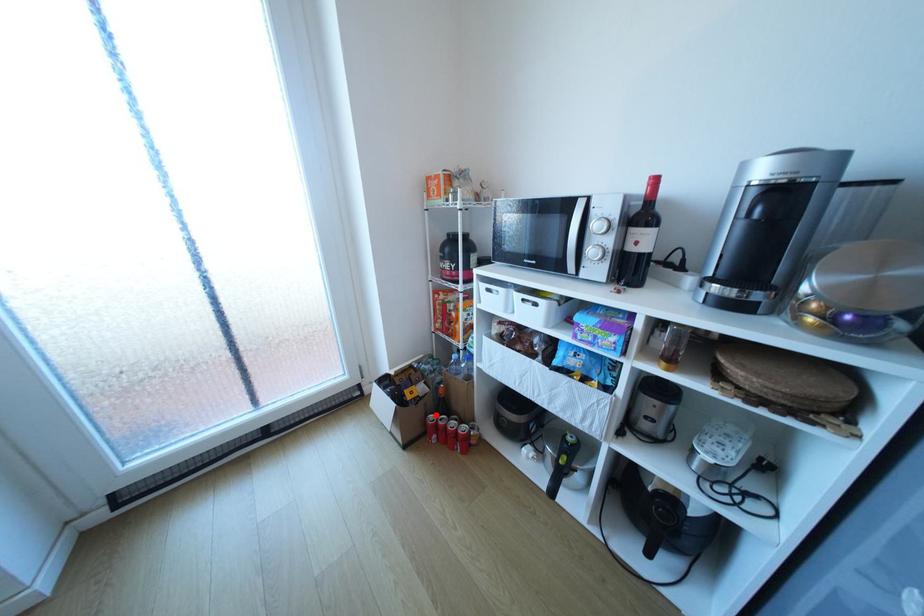
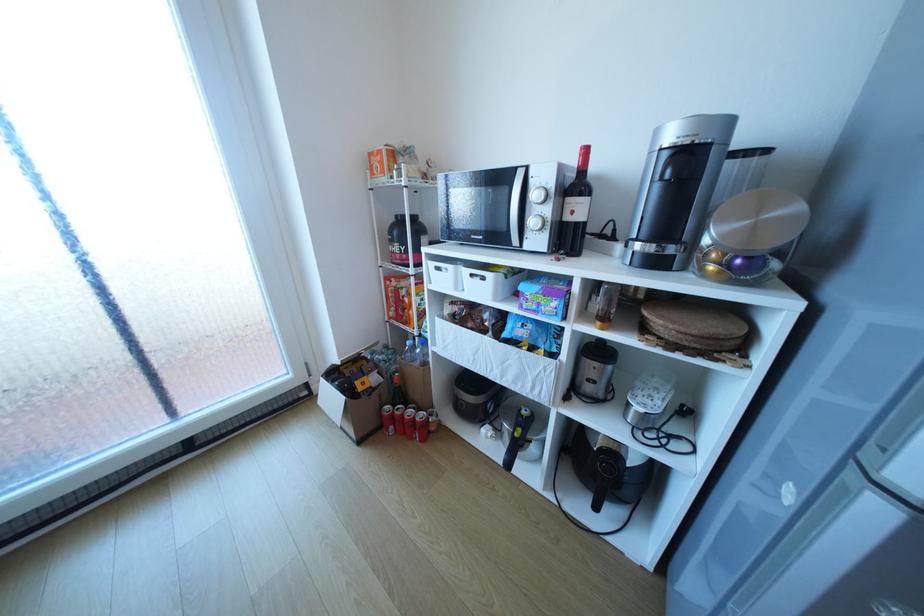
Find the pixel in the second image that matches the highlighted location in the first image.

(391, 407)